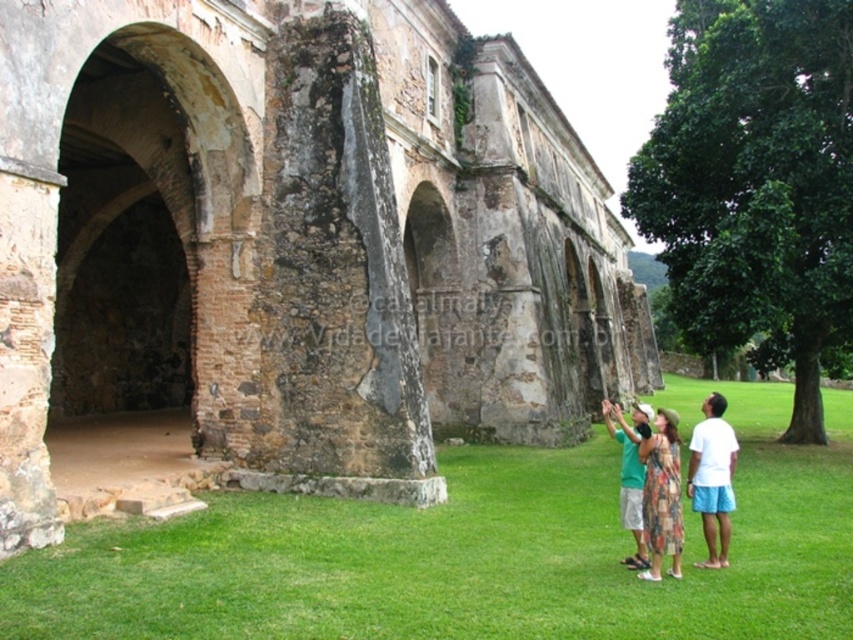
Is green grass at lower center wider than printed cotton dress at lower center?

Yes, green grass at lower center is wider than printed cotton dress at lower center.

Which is behind, point (567, 547) or point (680, 518)?

Positioned behind is point (567, 547).

Does point (517, 582) come in front of point (676, 560)?

Yes, point (517, 582) is closer to viewer.

Where is `green grass at lower center`? The width and height of the screenshot is (853, 640). green grass at lower center is located at coordinates (471, 552).

Does printed cotton dress at lower center have a smaller size compared to green cotton shirt at center?

Yes.

This screenshot has width=853, height=640. I want to click on printed cotton dress at lower center, so [662, 493].

Who is more distant from viewer, (x=671, y=420) or (x=630, y=433)?

Positioned behind is point (x=630, y=433).

Find the location of a particular element. The width and height of the screenshot is (853, 640). printed cotton dress at lower center is located at coordinates (662, 493).

Is point (49, 51) in front of point (515, 506)?

Yes, it is in front of point (515, 506).

You are a GUI agent. You are given a task and a screenshot of the screen. Output one action in this format:
    pyautogui.click(x=<x>, y=<y>)
    Task: Click on the weathered stone arches at center
    
    Given the screenshot: What is the action you would take?
    pyautogui.click(x=294, y=246)